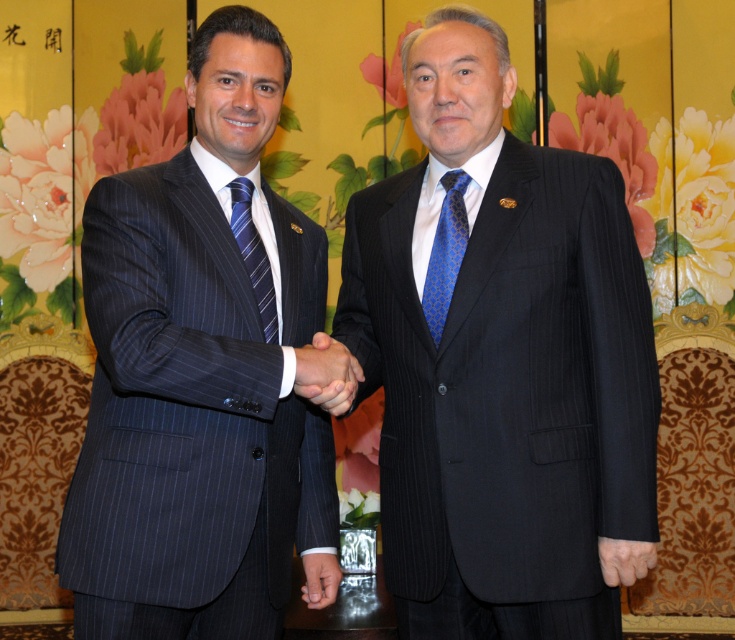
You are a photographer setting up for a formal event. You need to position a light source to the right of the blue pinstripe suit at left and the blue striped tie at left. Based on their widths, which object requires a wider light beam to fully illuminate?

The blue pinstripe suit at left might be wider than the blue striped tie at left, so the light beam should be adjusted to accommodate the wider blue pinstripe suit at left for full illumination.

You are an AI analyzing the spatial coordinates of objects in an image. The scene shows two men in formal attire shaking hands in front of a decorative backdrop. You need to determine the exact 2D coordinates of the blue pinstripe suit at left. What are its coordinates?

The blue pinstripe suit at left is located at the 2D coordinates of point (200, 378).